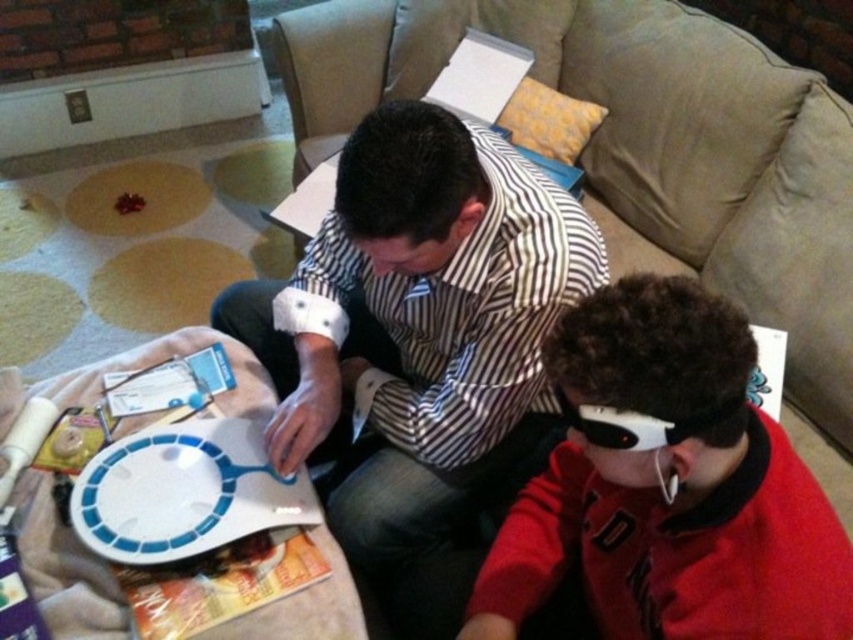
You are standing at the entrance of the room and want to sit on the beige fabric couch at center. According to the coordinates provided, in which direction should you move relative to your current position?

The beige fabric couch at center is located at coordinates point (643, 147), so you should move towards the lower right direction from your current position at the entrance.

Based on the scene description, where is the striped fabric shirt at center located in terms of its 2D coordinates?

The striped fabric shirt at center is located at the 2D coordinates point (419, 332).

You are a guest in this living room and want to place a small gift on the table between the beige fabric couch at center and the white plastic platter at center. Which object should you use as a reference point to ensure the gift is placed correctly?

The white plastic platter at center is to the left of the beige fabric couch at center. To place the gift between them, position it near the white plastic platter at center since it is closer to the table.